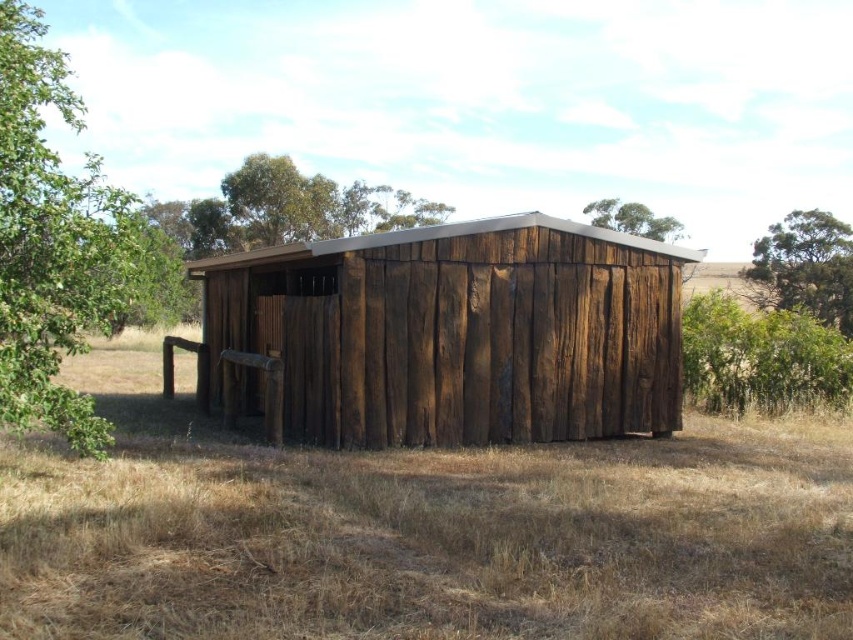
Looking at this image, you are standing in front of the rustic wooden shed and notice two green leafy trees in the background. Which tree, the green leafy tree at upper right or the green leafy tree at upper center, is closer to the shed?

The green leafy tree at upper right is positioned under the green leafy tree at upper center, meaning it is closer to the shed than the other tree.